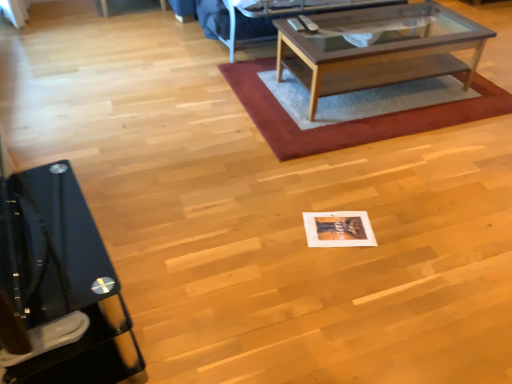
Question: From a real-world perspective, is wooden glass coffee table at center below black glossy desk at left?

Choices:
 (A) no
 (B) yes

Answer: (B)

Question: Does wooden glass coffee table at center have a lesser height compared to black glossy desk at left?

Choices:
 (A) yes
 (B) no

Answer: (A)

Question: Considering the relative sizes of wooden glass coffee table at center and black glossy desk at left in the image provided, is wooden glass coffee table at center wider than black glossy desk at left?

Choices:
 (A) no
 (B) yes

Answer: (B)

Question: Does wooden glass coffee table at center have a lesser width compared to black glossy desk at left?

Choices:
 (A) yes
 (B) no

Answer: (B)

Question: Does wooden glass coffee table at center contain black glossy desk at left?

Choices:
 (A) no
 (B) yes

Answer: (A)

Question: Is wooden glass coffee table at center not within black glossy desk at left?

Choices:
 (A) no
 (B) yes

Answer: (B)

Question: Is the depth of wooden glass coffee table at center greater than that of rug with woven texture at center?

Choices:
 (A) yes
 (B) no

Answer: (B)

Question: Could you tell me if wooden glass coffee table at center is turned towards rug with woven texture at center?

Choices:
 (A) yes
 (B) no

Answer: (B)

Question: Is wooden glass coffee table at center to the right of rug with woven texture at center from the viewer's perspective?

Choices:
 (A) yes
 (B) no

Answer: (A)

Question: Considering the relative sizes of wooden glass coffee table at center and rug with woven texture at center in the image provided, is wooden glass coffee table at center wider than rug with woven texture at center?

Choices:
 (A) no
 (B) yes

Answer: (A)

Question: Would you say wooden glass coffee table at center is a long distance from rug with woven texture at center?

Choices:
 (A) yes
 (B) no

Answer: (B)

Question: Does wooden glass coffee table at center lie in front of rug with woven texture at center?

Choices:
 (A) yes
 (B) no

Answer: (A)

Question: Considering the relative sizes of rug with woven texture at center and black glossy desk at left in the image provided, is rug with woven texture at center shorter than black glossy desk at left?

Choices:
 (A) yes
 (B) no

Answer: (A)